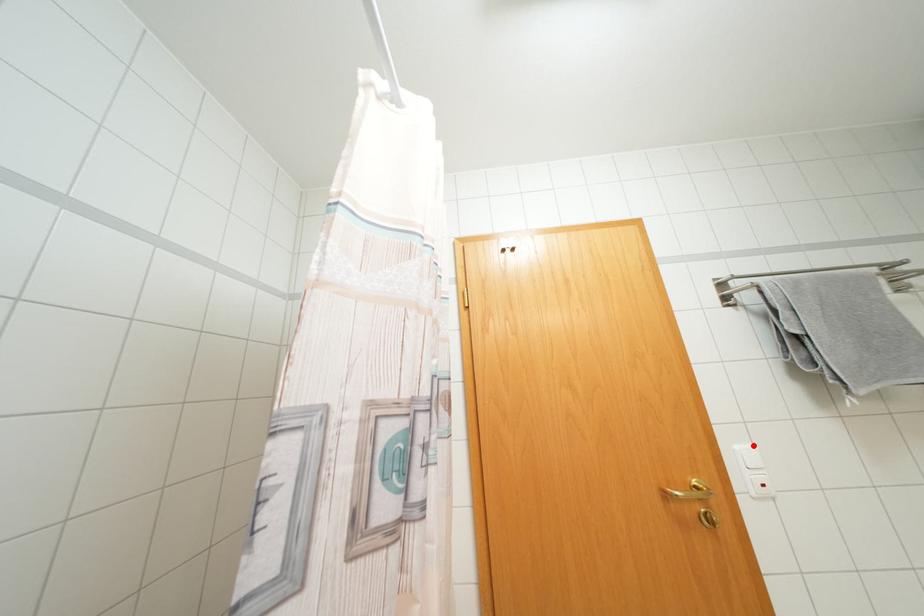
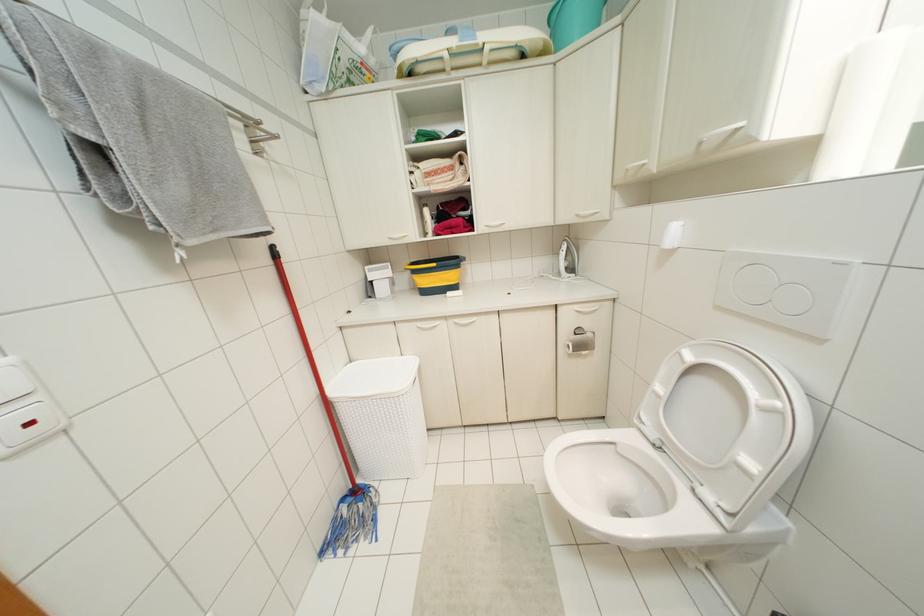
Question: I am providing you with two images of the same scene from different viewpoints. A red point is marked on the first image. Can you still see the location of the red point in image 2?

Choices:
 (A) Yes
 (B) No

Answer: (A)